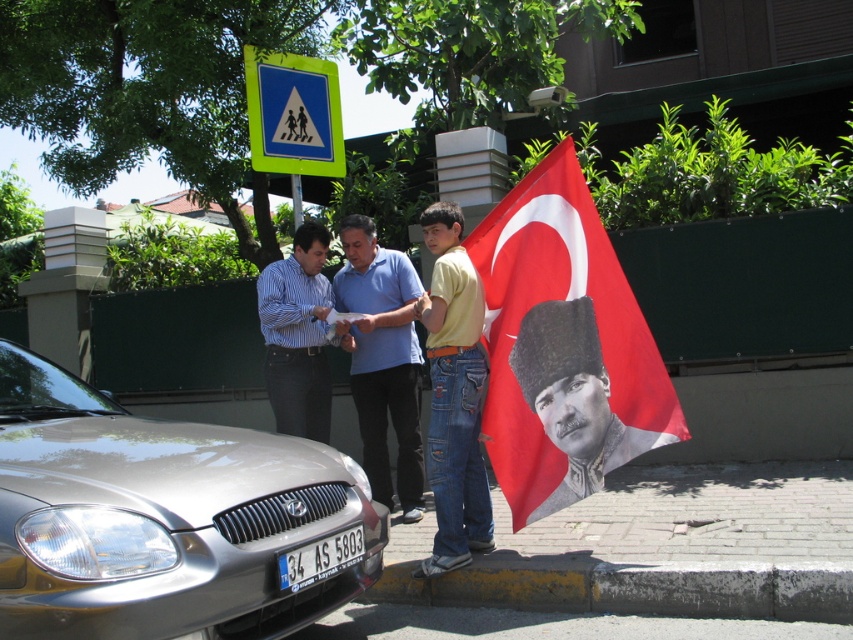
Question: Can you confirm if green plastic pedestrian crossing sign at upper center is wider than white plastic license plate at lower center?

Choices:
 (A) yes
 (B) no

Answer: (A)

Question: Is black textured portrait at center above green plastic pedestrian crossing sign at upper center?

Choices:
 (A) yes
 (B) no

Answer: (B)

Question: Does blue shirt at center appear under green plastic pedestrian crossing sign at upper center?

Choices:
 (A) no
 (B) yes

Answer: (B)

Question: Which point is farther from the camera taking this photo?

Choices:
 (A) (35, 454)
 (B) (341, 339)

Answer: (B)

Question: Which of the following is the closest to the observer?

Choices:
 (A) satin silver car at lower left
 (B) black textured portrait at center

Answer: (A)

Question: Which is farther from the green plastic pedestrian crossing sign at upper center?

Choices:
 (A) denim jeans at center
 (B) red fabric flag at center
 (C) white plastic license plate at lower center
 (D) black textured portrait at center

Answer: (C)